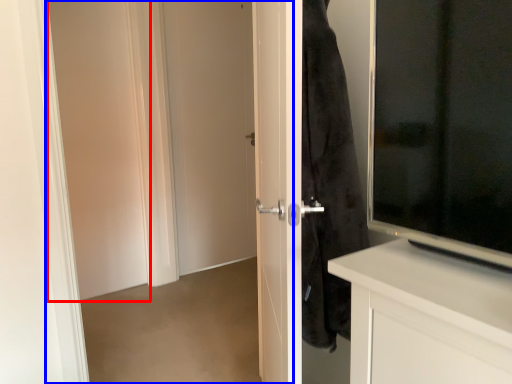
Question: Which object is further to the camera taking this photo, screen door (highlighted by a red box) or screen door (highlighted by a blue box)?

Choices:
 (A) screen door
 (B) screen door

Answer: (A)